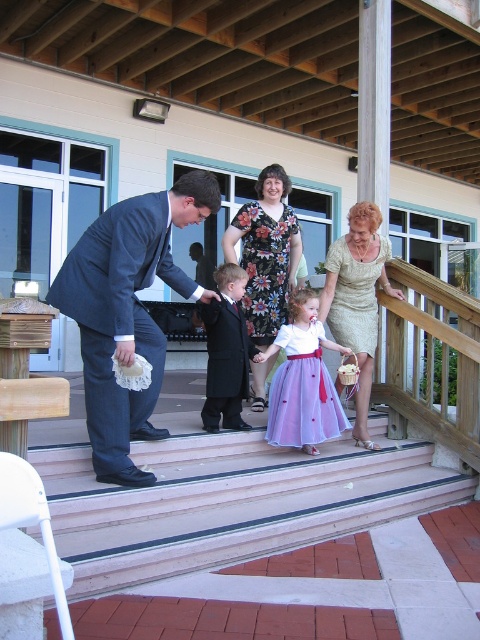
Is dark blue suit at center thinner than matte black suit at center?

In fact, dark blue suit at center might be wider than matte black suit at center.

Can you confirm if dark blue suit at center is taller than matte black suit at center?

Correct, dark blue suit at center is much taller as matte black suit at center.

Is point (151, 218) farther from viewer compared to point (238, 355)?

No, (151, 218) is closer to viewer.

The width and height of the screenshot is (480, 640). In order to click on dark blue suit at center in this screenshot , I will do `click(128, 312)`.

Is smooth concrete stairs at center taller than matte black suit at left?

Incorrect, smooth concrete stairs at center's height is not larger of matte black suit at left's.

Measure the distance between smooth concrete stairs at center and camera.

smooth concrete stairs at center and camera are 2.65 meters apart.

At what (x,y) coordinates should I click in order to perform the action: click on smooth concrete stairs at center. Please return your answer as a coordinate pair (x, y). The image size is (480, 640). Looking at the image, I should click on (229, 500).

This screenshot has height=640, width=480. What do you see at coordinates (265, 253) in the screenshot?
I see `floral dress at center` at bounding box center [265, 253].

Between floral dress at center and lavender satin dress at center, which one appears on the left side from the viewer's perspective?

Positioned to the left is floral dress at center.

Between point (262, 227) and point (310, 353), which one is positioned in front?

Point (310, 353) is more forward.

Identify the location of floral dress at center. (265, 253).